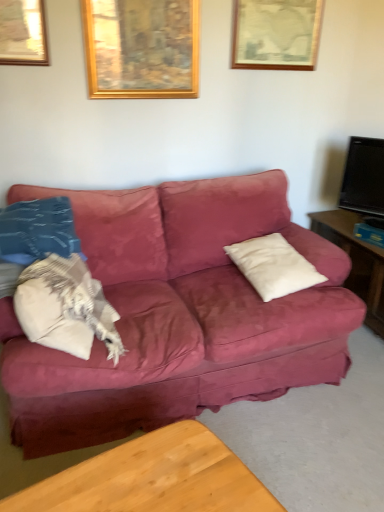
Question: Is gold wooden picture frame at upper center, arranged as the 2th picture frame when viewed from the right, at the left side of wooden framed picture at upper center, positioned as the second picture frame in left-to-right order?

Choices:
 (A) no
 (B) yes

Answer: (B)

Question: Does gold wooden picture frame at upper center, which is counted as the first picture frame, starting from the left, lie in front of wooden framed picture at upper center, positioned as the second picture frame in left-to-right order?

Choices:
 (A) yes
 (B) no

Answer: (A)

Question: From a real-world perspective, does gold wooden picture frame at upper center, which is counted as the first picture frame, starting from the left, stand above wooden framed picture at upper center, placed as the first picture frame when sorted from right to left?

Choices:
 (A) no
 (B) yes

Answer: (A)

Question: Can you confirm if gold wooden picture frame at upper center, arranged as the 2th picture frame when viewed from the right, is positioned to the right of wooden framed picture at upper center, positioned as the second picture frame in left-to-right order?

Choices:
 (A) yes
 (B) no

Answer: (B)

Question: Can you confirm if gold wooden picture frame at upper center, arranged as the 2th picture frame when viewed from the right, is taller than wooden framed picture at upper center, placed as the first picture frame when sorted from right to left?

Choices:
 (A) no
 (B) yes

Answer: (B)

Question: Considering the positions of wooden framed picture at upper center, placed as the first picture frame when sorted from right to left, and white soft pillow at center, which is counted as the second pillow, starting from the left, in the image, is wooden framed picture at upper center, placed as the first picture frame when sorted from right to left, taller or shorter than white soft pillow at center, which is counted as the second pillow, starting from the left,?

Choices:
 (A) short
 (B) tall

Answer: (B)

Question: Considering their positions, is wooden framed picture at upper center, positioned as the second picture frame in left-to-right order, located in front of or behind white soft pillow at center, which is counted as the second pillow, starting from the left?

Choices:
 (A) behind
 (B) front

Answer: (A)

Question: Is wooden framed picture at upper center, placed as the first picture frame when sorted from right to left, situated inside white soft pillow at center, which appears as the first pillow when viewed from the right, or outside?

Choices:
 (A) outside
 (B) inside

Answer: (A)

Question: Considering the positions of point (307, 64) and point (251, 267), is point (307, 64) closer or farther from the camera than point (251, 267)?

Choices:
 (A) closer
 (B) farther

Answer: (B)

Question: In terms of size, does white soft pillow at left, the second pillow viewed from the right, appear bigger or smaller than wooden coffee table at lower center?

Choices:
 (A) big
 (B) small

Answer: (A)

Question: From the image's perspective, is white soft pillow at left, the second pillow viewed from the right, positioned above or below wooden coffee table at lower center?

Choices:
 (A) above
 (B) below

Answer: (A)

Question: Which is correct: white soft pillow at left, the second pillow viewed from the right, is inside wooden coffee table at lower center, or outside of it?

Choices:
 (A) outside
 (B) inside

Answer: (A)

Question: In the image, is white soft pillow at left, the second pillow viewed from the right, positioned in front of or behind wooden coffee table at lower center?

Choices:
 (A) behind
 (B) front

Answer: (A)

Question: Is gold wooden picture frame at upper center, arranged as the 2th picture frame when viewed from the right, in front of or behind wooden coffee table at lower center in the image?

Choices:
 (A) behind
 (B) front

Answer: (A)

Question: Is gold wooden picture frame at upper center, arranged as the 2th picture frame when viewed from the right, wider or thinner than wooden coffee table at lower center?

Choices:
 (A) thin
 (B) wide

Answer: (A)